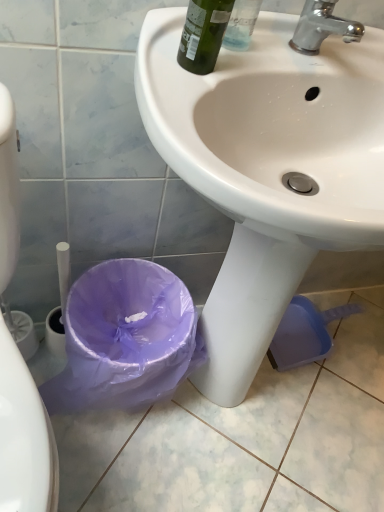
I want to click on vacant space situated on the left part of chrome metallic faucet at upper right, so click(x=233, y=32).